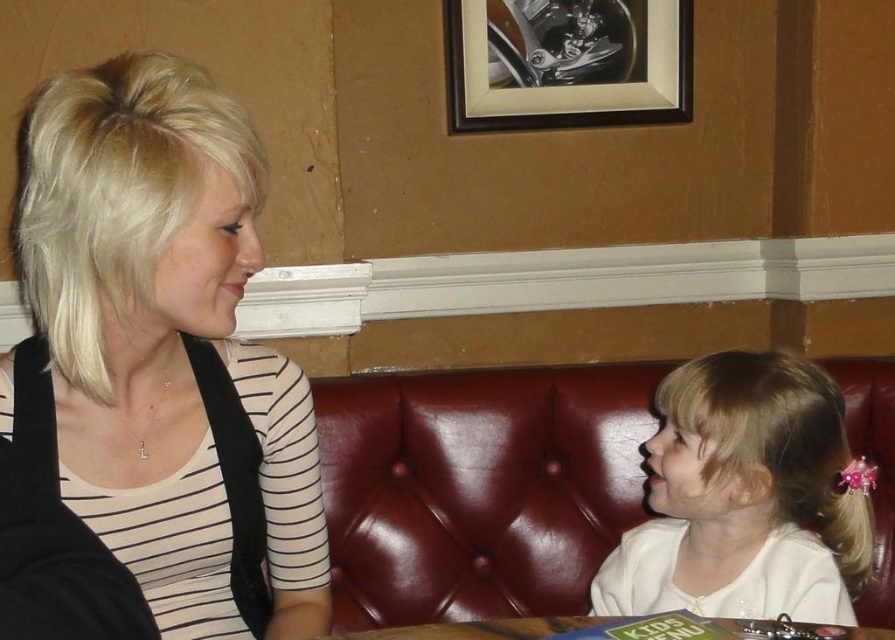
Is wooden framed print at upper center to the right of wooden table at lower center from the viewer's perspective?

Yes, wooden framed print at upper center is to the right of wooden table at lower center.

Which is more to the left, wooden framed print at upper center or wooden table at lower center?

wooden table at lower center is more to the left.

Who is more distant from viewer, (663,51) or (337,637)?

The point (663,51) is behind.

At what (x,y) coordinates should I click in order to perform the action: click on wooden framed print at upper center. Please return your answer as a coordinate pair (x, y). This screenshot has width=895, height=640. Looking at the image, I should click on (567, 61).

Can you confirm if white matte hair clip at right is wider than wooden table at lower center?

In fact, white matte hair clip at right might be narrower than wooden table at lower center.

Is white matte hair clip at right smaller than wooden table at lower center?

No, white matte hair clip at right is not smaller than wooden table at lower center.

Which is behind, point (830, 422) or point (495, 627)?

The point (830, 422) is more distant.

This screenshot has height=640, width=895. In order to click on white matte hair clip at right in this screenshot , I will do `click(744, 499)`.

Is matte black hair at left positioned before wooden framed print at upper center?

Yes.

Is matte black hair at left wider than wooden framed print at upper center?

In fact, matte black hair at left might be narrower than wooden framed print at upper center.

Which is behind, point (295, 428) or point (550, 84)?

The point (550, 84) is behind.

What are the coordinates of `matte black hair at left` in the screenshot? It's located at (163, 353).